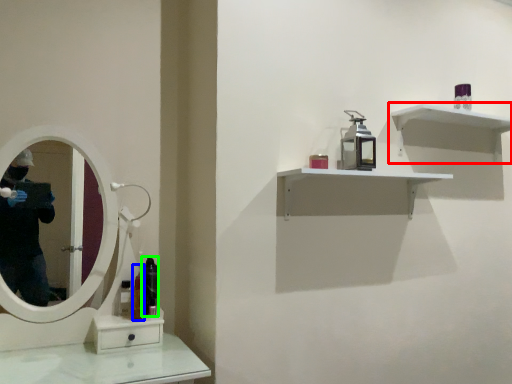
Question: Which is nearer to the shelf (highlighted by a red box)? mouthwash (highlighted by a blue box) or mouthwash (highlighted by a green box).

Choices:
 (A) mouthwash
 (B) mouthwash

Answer: (B)